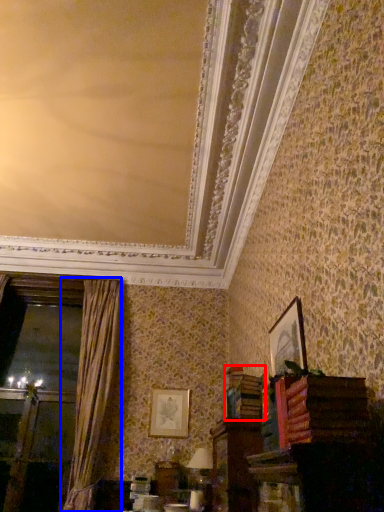
Question: Which object is further to the camera taking this photo, book (highlighted by a red box) or curtain (highlighted by a blue box)?

Choices:
 (A) book
 (B) curtain

Answer: (B)